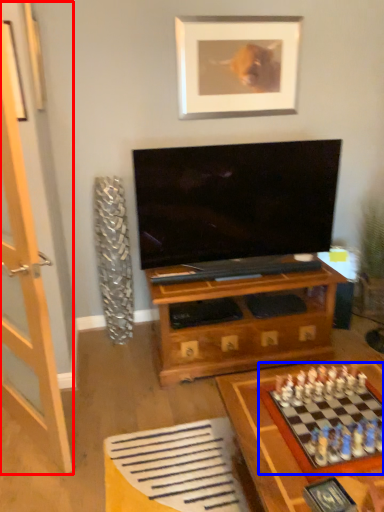
Question: Which of the following is the farthest to the observer, glass door (highlighted by a red box) or board game (highlighted by a blue box)?

Choices:
 (A) glass door
 (B) board game

Answer: (B)